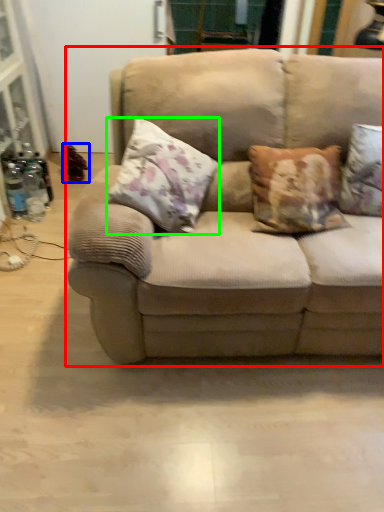
Question: Which object is the farthest from studio couch (highlighted by a red box)? Choose among these: toy (highlighted by a blue box) or pillow (highlighted by a green box).

Choices:
 (A) toy
 (B) pillow

Answer: (A)